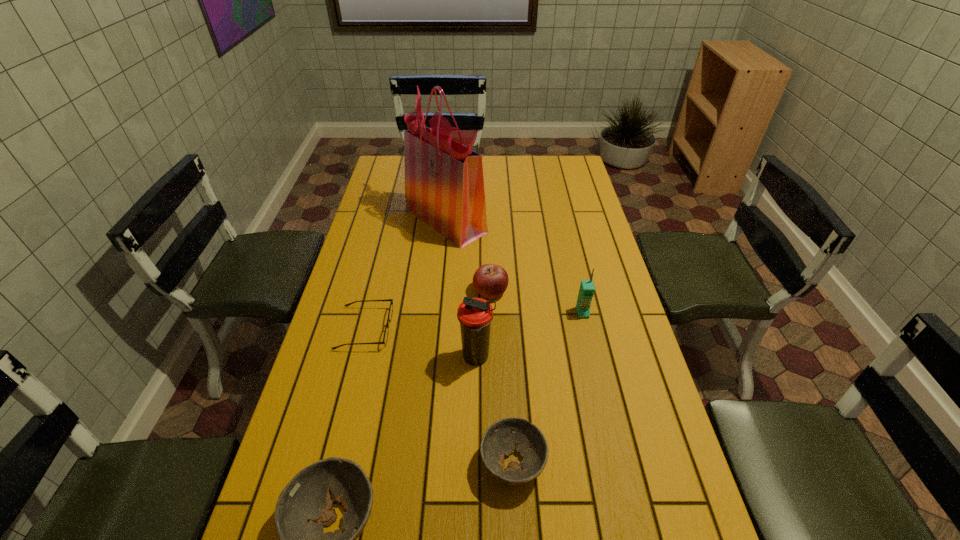
In order to click on the second shortest object in this screenshot , I will do `click(499, 440)`.

Locate an element on the screen. the right bowl is located at coordinates (499, 440).

Find the location of a particular element. This screenshot has width=960, height=540. spectacles is located at coordinates (385, 337).

This screenshot has width=960, height=540. I want to click on apple, so click(x=490, y=281).

Where is `shopping bag`? shopping bag is located at coordinates (444, 185).

Find the location of a particular element. This screenshot has height=540, width=960. the farthest object is located at coordinates (444, 185).

Identify the location of the rightmost object. The height and width of the screenshot is (540, 960). (586, 292).

Identify the location of cellular telephone. The image size is (960, 540). (586, 292).

Identify the location of thermos bottle. This screenshot has width=960, height=540. (475, 315).

This screenshot has width=960, height=540. Identify the location of vacant space located 0.300m on the left of the right bowl. (349, 463).